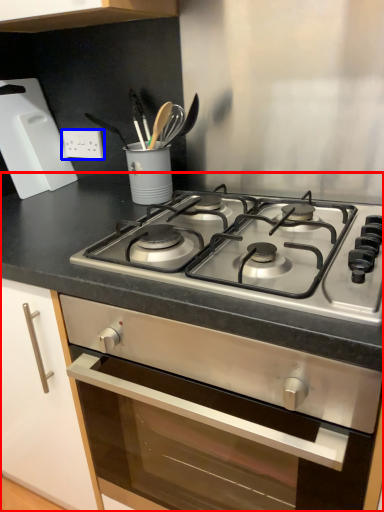
Question: Which object appears farthest to the camera in this image, countertop (highlighted by a red box) or electric outlet (highlighted by a blue box)?

Choices:
 (A) countertop
 (B) electric outlet

Answer: (B)